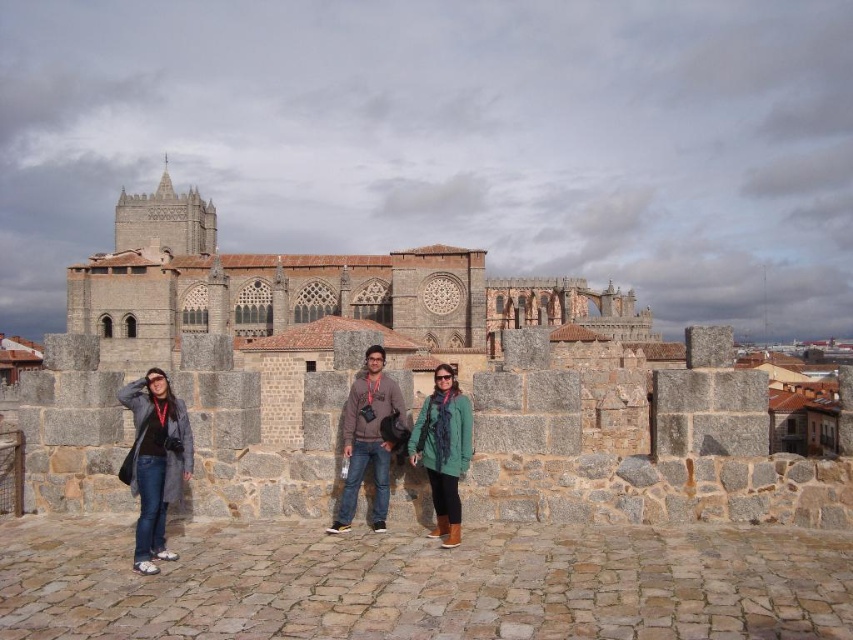
In the scene shown: Does green wool scarf at center come in front of green fuzzy sweater at center?

No, green wool scarf at center is further to the viewer.

This screenshot has height=640, width=853. What do you see at coordinates (444, 449) in the screenshot?
I see `green wool scarf at center` at bounding box center [444, 449].

You are a GUI agent. You are given a task and a screenshot of the screen. Output one action in this format:
    pyautogui.click(x=<x>, y=<y>)
    Task: Click on the green wool scarf at center
    This screenshot has width=853, height=640.
    Given the screenshot: What is the action you would take?
    pyautogui.click(x=444, y=449)

Can you confirm if gray stone fort at center is positioned above green wool scarf at center?

Indeed, gray stone fort at center is positioned over green wool scarf at center.

What do you see at coordinates (306, 291) in the screenshot?
I see `gray stone fort at center` at bounding box center [306, 291].

In order to click on gray stone fort at center in this screenshot , I will do `click(306, 291)`.

Which is more to the right, gray wool coat at left or green fuzzy sweater at center?

green fuzzy sweater at center

Is the position of gray wool coat at left less distant than that of green fuzzy sweater at center?

Yes.

Who is more forward, (136, 467) or (422, 435)?

Point (136, 467)

The image size is (853, 640). Identify the location of gray wool coat at left. (154, 461).